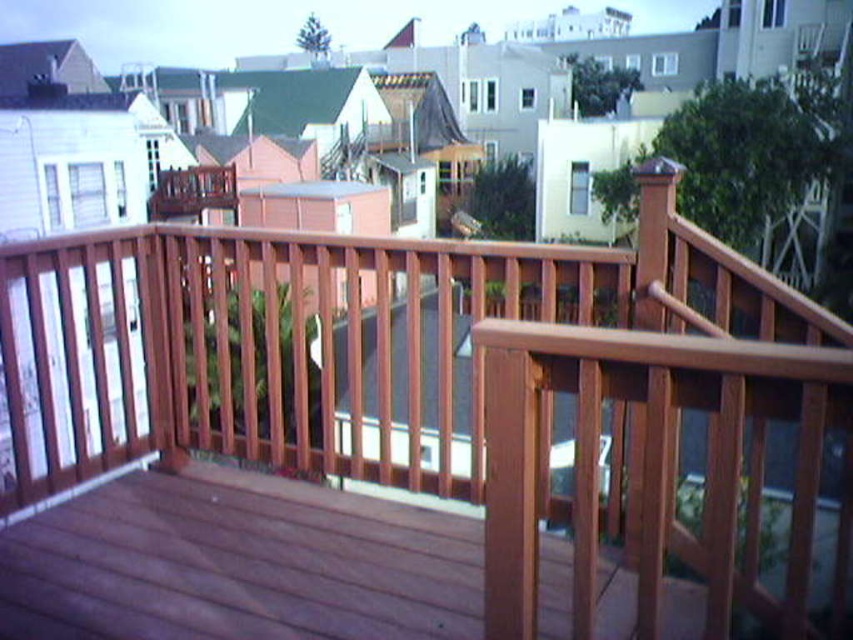
Question: Which point is closer to the camera?

Choices:
 (A) smooth wood deck at center
 (B) wooden deck at center

Answer: (A)

Question: Which point is closer to the camera?

Choices:
 (A) smooth wood deck at center
 (B) wooden deck at center

Answer: (A)

Question: Does smooth wood deck at center appear on the right side of wooden deck at center?

Choices:
 (A) yes
 (B) no

Answer: (A)

Question: Where is smooth wood deck at center located in relation to wooden deck at center in the image?

Choices:
 (A) below
 (B) above

Answer: (A)

Question: Can you confirm if smooth wood deck at center is positioned to the left of wooden deck at center?

Choices:
 (A) no
 (B) yes

Answer: (A)